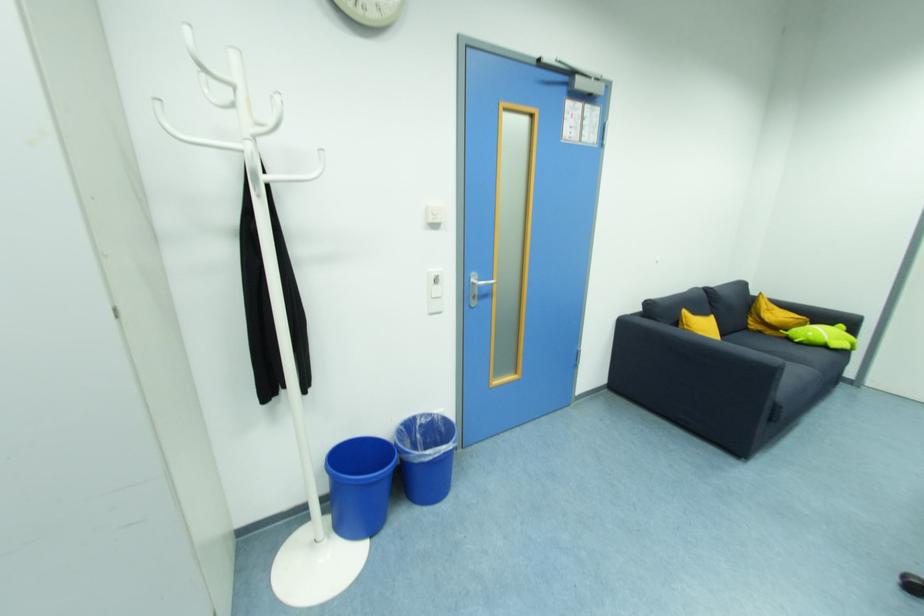
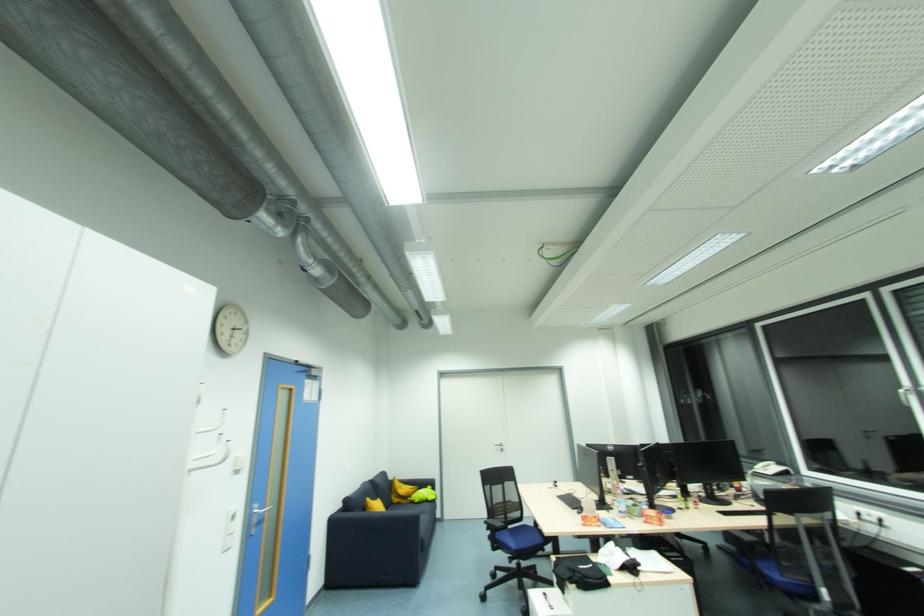
The point at (x=757, y=328) is marked in the first image. Where is the corresponding point in the second image?

(397, 501)